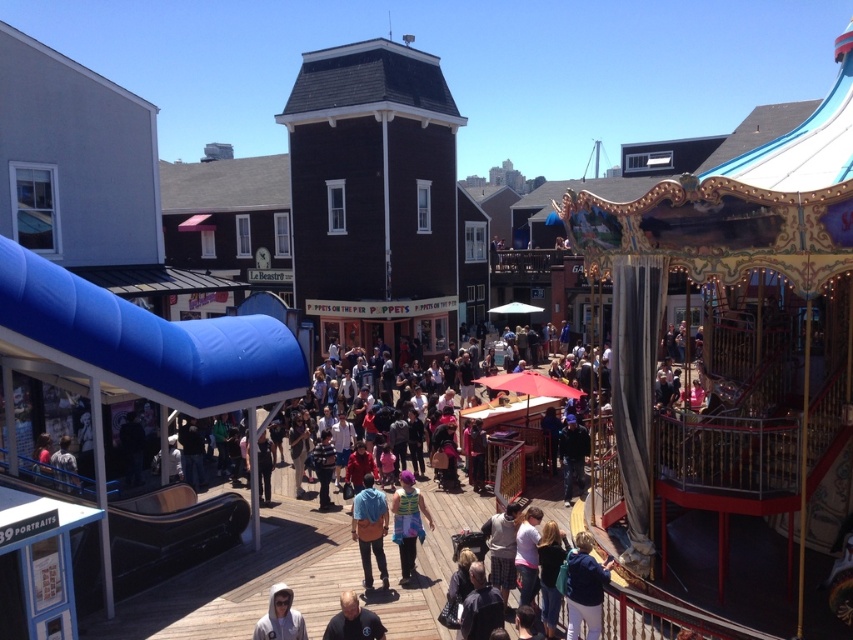
You are a photographer positioned at the origin point of the image. You want to take a photo of the blue denim jacket at center. According to the coordinates provided, in which direction should you move to capture the jacket in your shot?

The blue denim jacket at center is located at coordinates point (370, 529). Since the origin is typically the bottom left corner, moving towards the right and slightly upward would position the camera to capture the jacket.

You are a photographer at the amusement park and want to capture both the blue denim jacket at center and the white hoodie at lower center in a single photo. Which clothing item should you focus on first to ensure both are in frame?

The blue denim jacket at center is thinner than the white hoodie at lower center, so you should focus on the white hoodie at lower center first to ensure both are in frame.